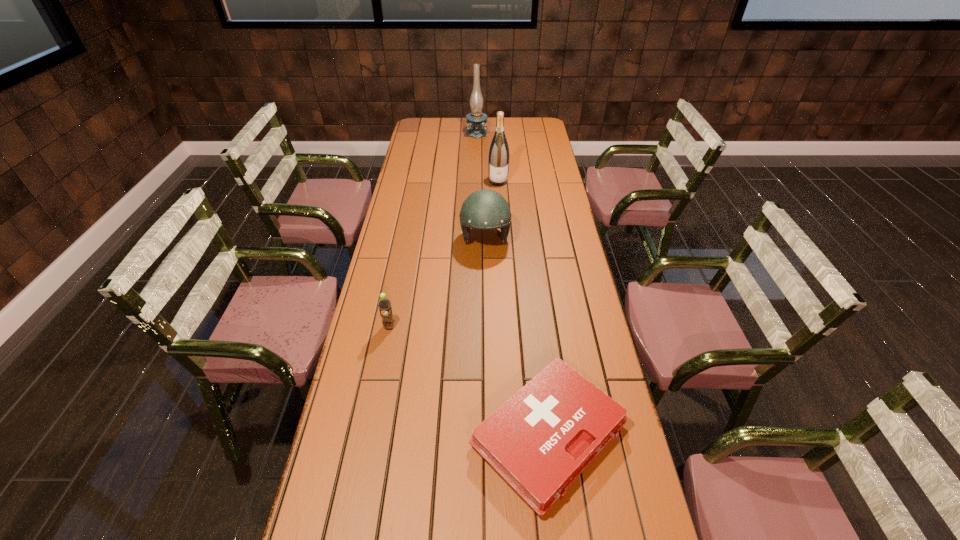
The width and height of the screenshot is (960, 540). I want to click on oil lamp, so click(x=476, y=121).

Locate an element on the screen. This screenshot has height=540, width=960. wine bottle is located at coordinates (499, 155).

This screenshot has height=540, width=960. I want to click on the third shortest object, so click(x=485, y=209).

Find the location of a particular element. This screenshot has width=960, height=540. football helmet is located at coordinates (485, 209).

You are a GUI agent. You are given a task and a screenshot of the screen. Output one action in this format:
    pyautogui.click(x=<x>, y=<y>)
    Task: Click on the soda
    The image size is (960, 540).
    Given the screenshot: What is the action you would take?
    pyautogui.click(x=384, y=304)

Identify the location of the second shortest object. The height and width of the screenshot is (540, 960). (384, 304).

You are a GUI agent. You are given a task and a screenshot of the screen. Output one action in this format:
    pyautogui.click(x=<x>, y=<y>)
    Task: Click on the shortest object
    
    Given the screenshot: What is the action you would take?
    pyautogui.click(x=539, y=441)

You are a GUI agent. You are given a task and a screenshot of the screen. Output one action in this format:
    pyautogui.click(x=<x>, y=<y>)
    Task: Click on the nearest object
    This screenshot has width=960, height=540.
    Given the screenshot: What is the action you would take?
    pyautogui.click(x=539, y=441)

Where is `free spot located on the front of the oil lamp`? The image size is (960, 540). free spot located on the front of the oil lamp is located at coordinates (476, 172).

I want to click on blank space located 0.120m on the label of the second farthest object, so click(x=499, y=201).